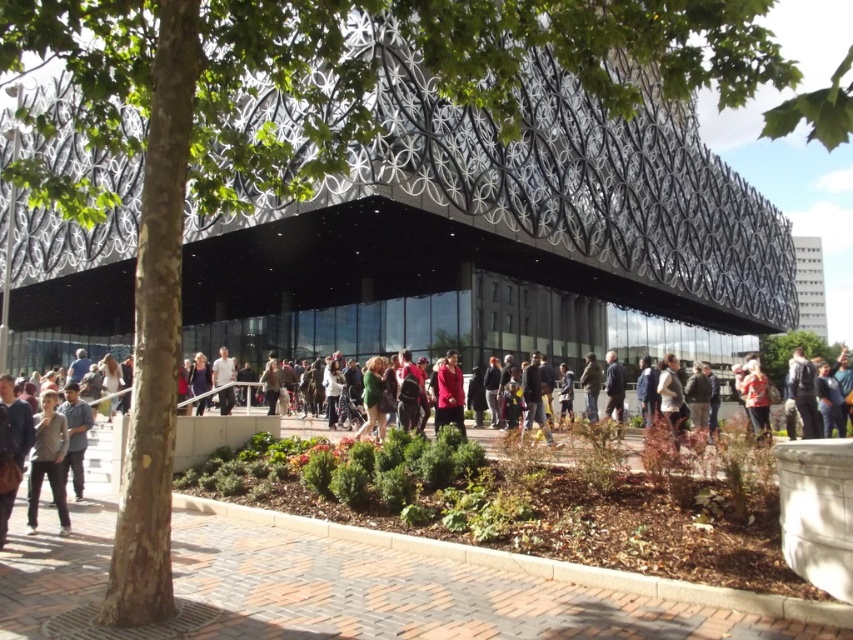
You are a photographer trying to capture both the gray cotton shirt at lower left and the matte red coat at center in a single frame. Which clothing item will appear smaller in your photo?

The gray cotton shirt at lower left will appear smaller in the photo because it has a smaller size compared to the matte red coat at center.

You are standing at the point marked as point [672,397] in the image. What object is located exactly at that point?

The green fabric jacket at center is located exactly at point [672,397].